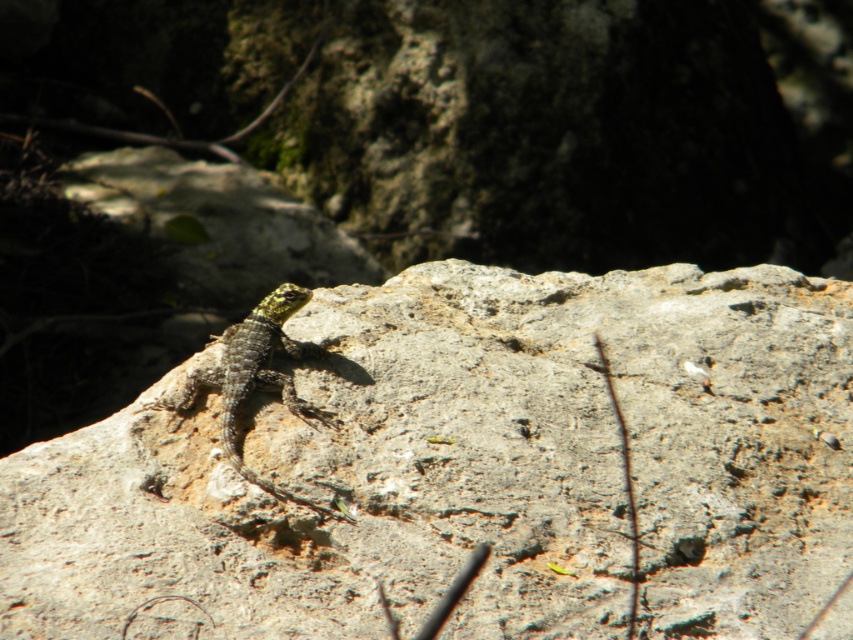
Question: Which object appears farthest from the camera in this image?

Choices:
 (A) green scaly lizard at center
 (B) gray rough rock at center

Answer: (A)

Question: Which object is closer to the camera taking this photo?

Choices:
 (A) green scaly lizard at center
 (B) gray rough rock at center

Answer: (B)

Question: Does gray rough rock at center appear over green scaly lizard at center?

Choices:
 (A) no
 (B) yes

Answer: (A)

Question: Is gray rough rock at center further to camera compared to green scaly lizard at center?

Choices:
 (A) no
 (B) yes

Answer: (A)

Question: Does gray rough rock at center appear on the right side of green scaly lizard at center?

Choices:
 (A) no
 (B) yes

Answer: (B)